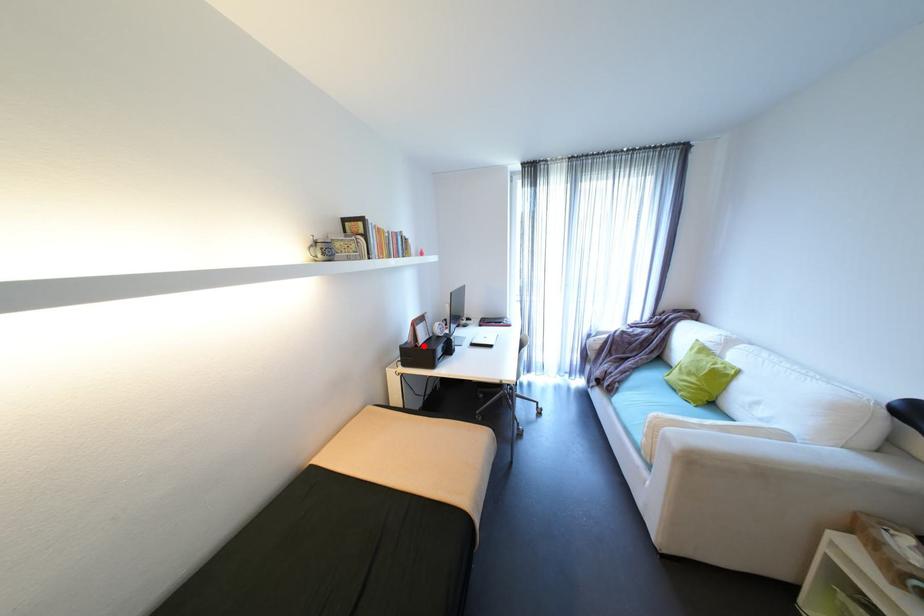
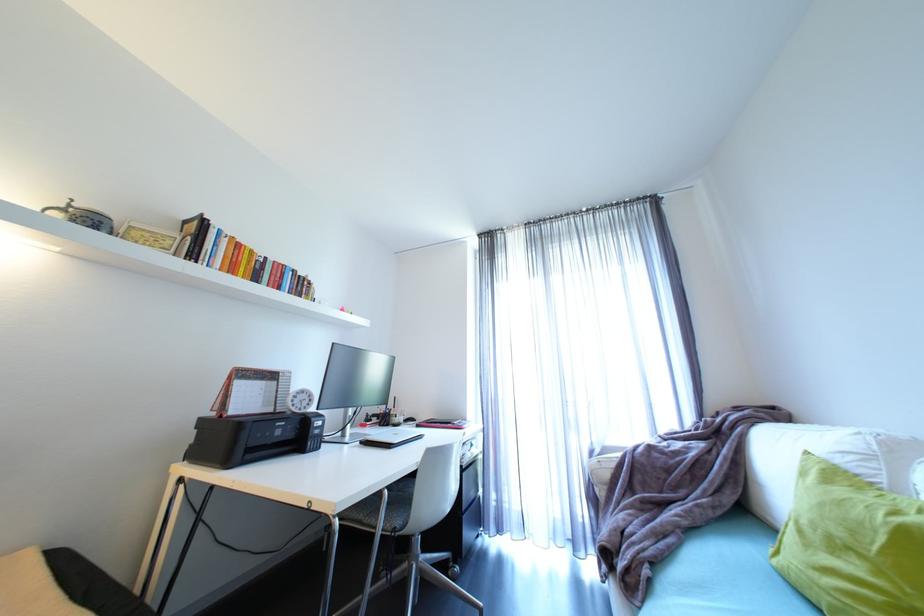
Where in the second image is the point corresponding to the highlighted location from the first image?

(228, 416)